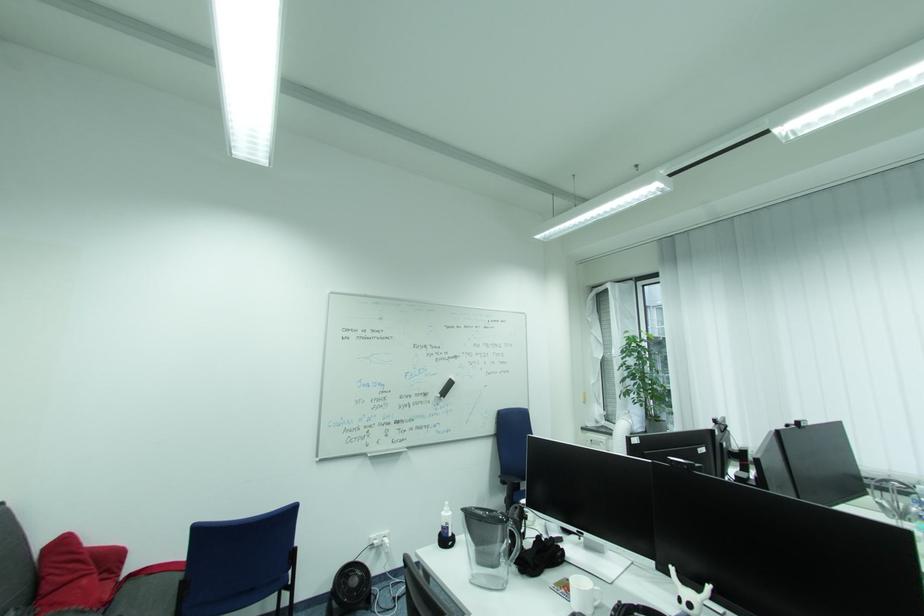
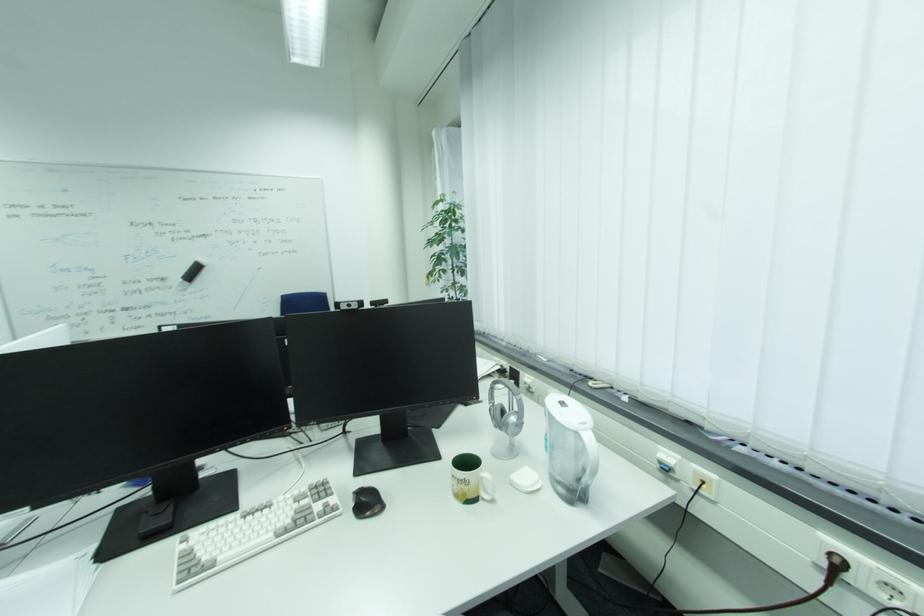
In the second image, find the point that corresponds to point (446, 394) in the first image.

(189, 278)